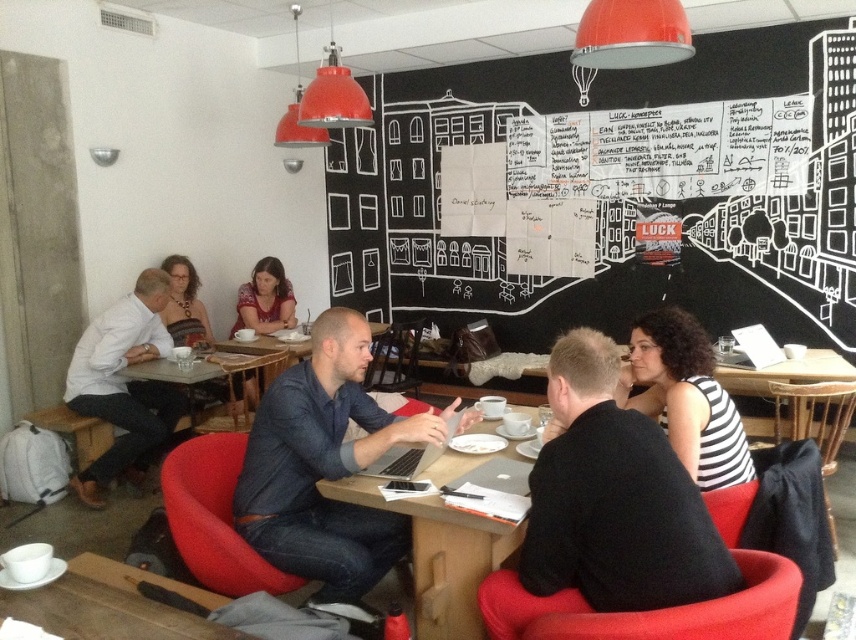
You are a painter who wants to place a 1.2 meter wide canvas between the blackboard at upper right and the dark blue fabric chair at lower right. Can the space between them accommodate the canvas?

The blackboard at upper right is wider than the dark blue fabric chair at lower right. Therefore, the space between them may not be wide enough to fit a 1.2 meter wide canvas. You should check the exact dimensions or consider a smaller canvas.

In the scene of a casual meeting, there is a matte white shirt at left and a silver metallic laptop at center. Which object is located to the left of the other?

The matte white shirt at left is positioned on the left side of the silver metallic laptop at center.

You are designing a layout for a small classroom and need to place both the blackboard at upper right and the dark blue fabric chair at lower right. Given their sizes, which object should be placed first to ensure they fit in the room?

The blackboard at upper right is bigger than the dark blue fabric chair at lower right, so you should place the blackboard first to accommodate its larger size before positioning the smaller chair.